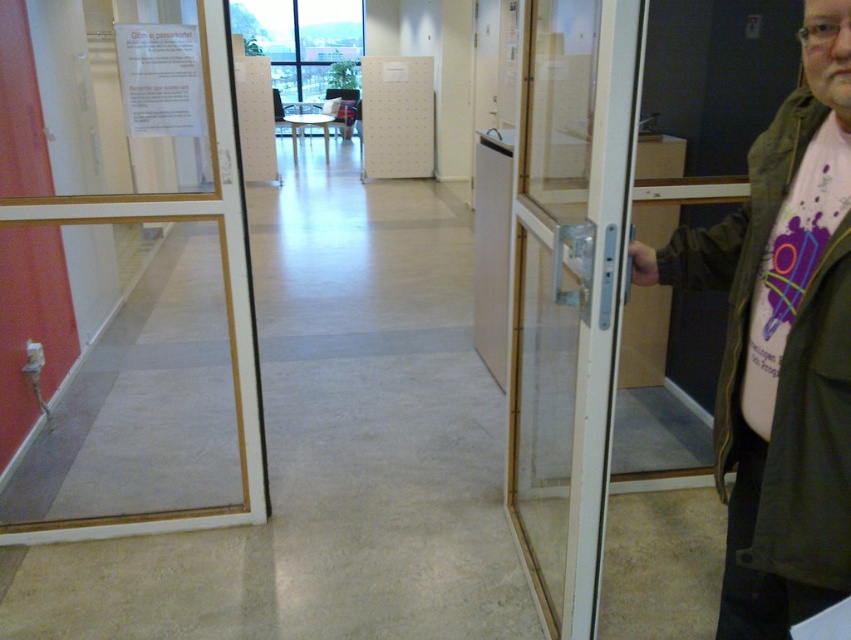
At what (x,y) coordinates should I click in order to perform the action: click on transparent glass door at right. Please return your answer as a coordinate pair (x, y). The height and width of the screenshot is (640, 851). Looking at the image, I should click on (568, 291).

Does transparent glass door at right come in front of clear glass door at left?

Yes, it is.

Which is behind, point (575, 141) or point (164, 524)?

Positioned behind is point (164, 524).

Locate an element on the screen. transparent glass door at right is located at coordinates (568, 291).

Is transparent glass door at right further to camera compared to green matte jacket at right?

Yes.

In the scene shown: Does transparent glass door at right have a smaller size compared to green matte jacket at right?

Actually, transparent glass door at right might be larger than green matte jacket at right.

Find the location of `transparent glass door at right`. transparent glass door at right is located at coordinates (568, 291).

Consider the image. Is green matte jacket at right shorter than clear glass door at left?

Yes.

Can you confirm if green matte jacket at right is positioned to the right of clear glass door at left?

Indeed, green matte jacket at right is positioned on the right side of clear glass door at left.

Which is in front, point (749, 540) or point (220, 216)?

Positioned in front is point (749, 540).

Image resolution: width=851 pixels, height=640 pixels. In order to click on green matte jacket at right in this screenshot , I will do `click(810, 435)`.